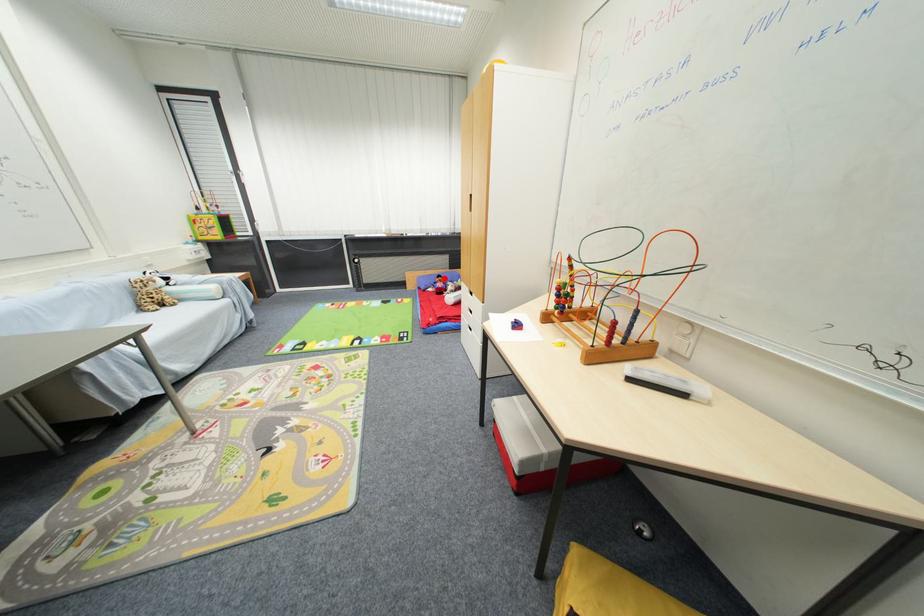
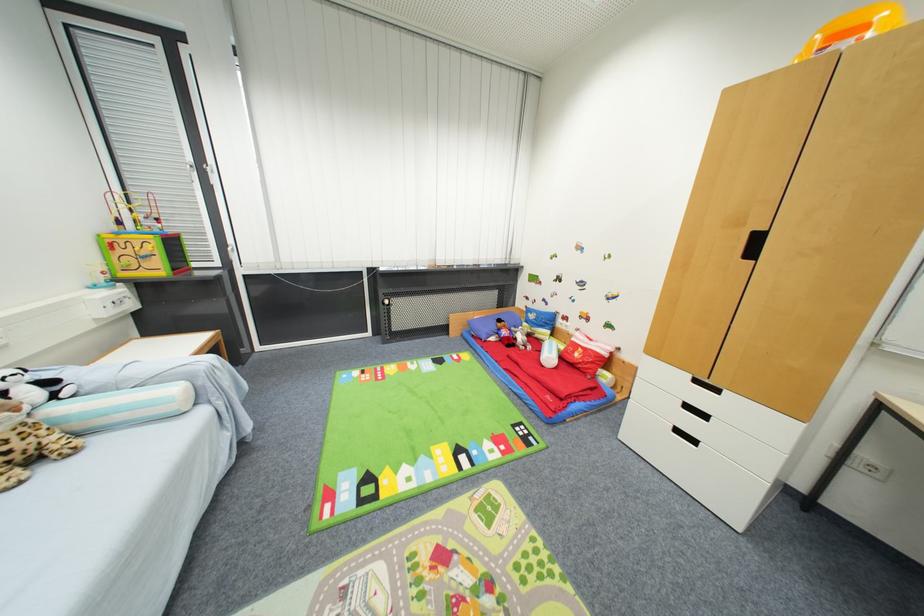
Find the pixel in the second image that matches the highlighted location in the first image.

(505, 323)